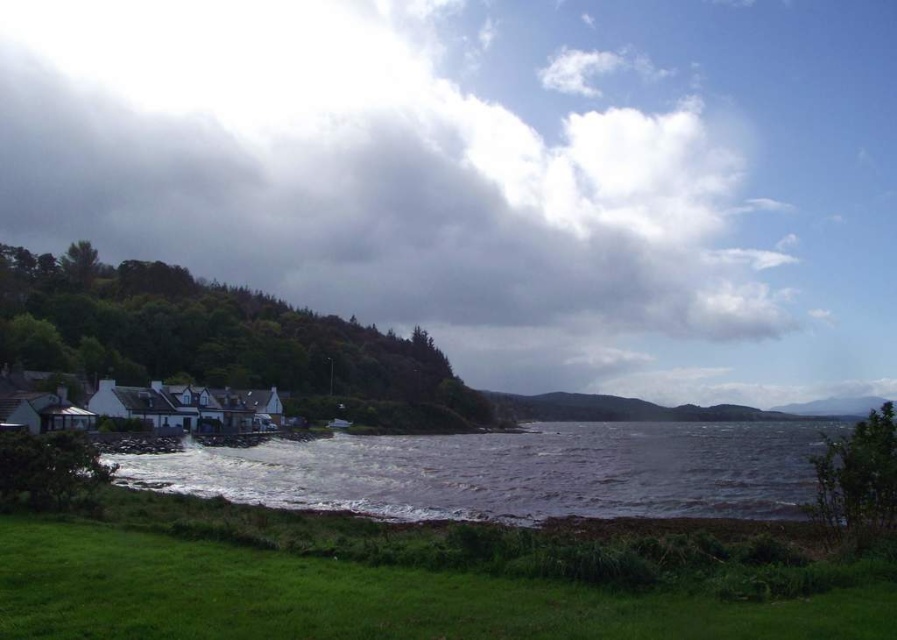
Who is more distant from viewer, (493,154) or (673,456)?

Positioned behind is point (493,154).

Find the location of a particular element. Image resolution: width=897 pixels, height=640 pixels. cloudy sky at upper center is located at coordinates (373, 180).